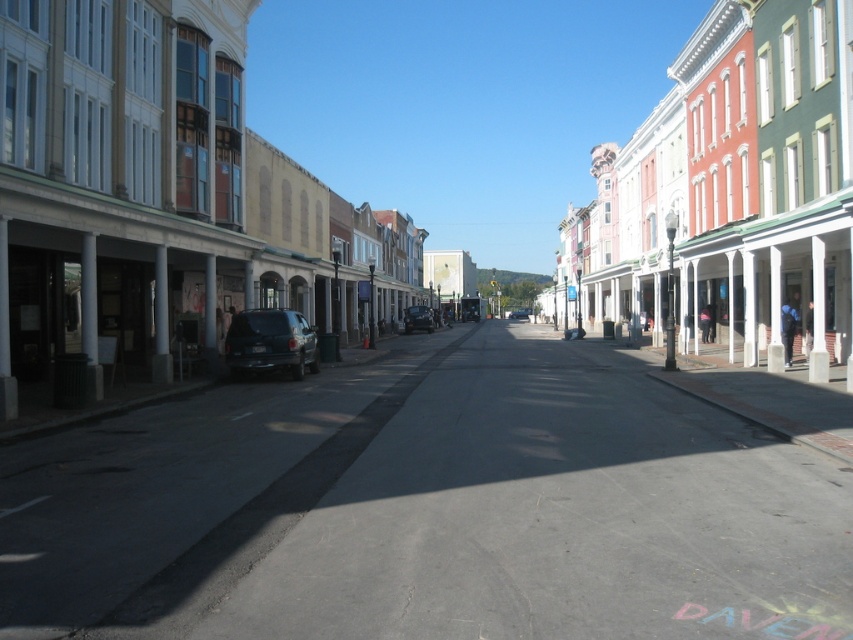
Does point (280, 316) come closer to viewer compared to point (432, 316)?

Yes, it is in front of point (432, 316).

Based on the photo, who is more distant from viewer, (x=259, y=310) or (x=418, y=330)?

Point (x=418, y=330)

Locate an element on the screen. The height and width of the screenshot is (640, 853). matte black suv at center is located at coordinates (270, 342).

Describe the element at coordinates (732, 193) in the screenshot. I see `red brick building at center` at that location.

Can you confirm if red brick building at center is positioned below shiny black car at center?

No, red brick building at center is not below shiny black car at center.

Is point (764, 168) more distant than point (416, 308)?

No, (764, 168) is closer to viewer.

Locate an element on the screen. red brick building at center is located at coordinates (732, 193).

In the scene shown: Who is positioned more to the left, shiny black car at center or matte black van at center?

shiny black car at center

Does shiny black car at center have a greater height compared to matte black van at center?

Incorrect, shiny black car at center's height is not larger of matte black van at center's.

Where is `shiny black car at center`? The height and width of the screenshot is (640, 853). shiny black car at center is located at coordinates (418, 317).

Locate an element on the screen. shiny black car at center is located at coordinates (418, 317).